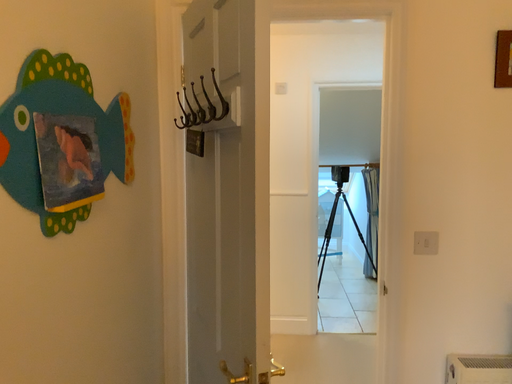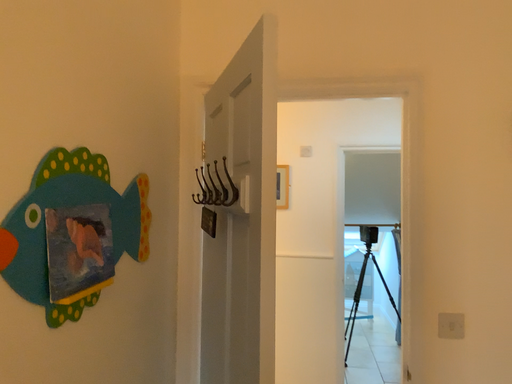
Question: Which way did the camera rotate in the video?

Choices:
 (A) rotated upward
 (B) rotated downward

Answer: (A)